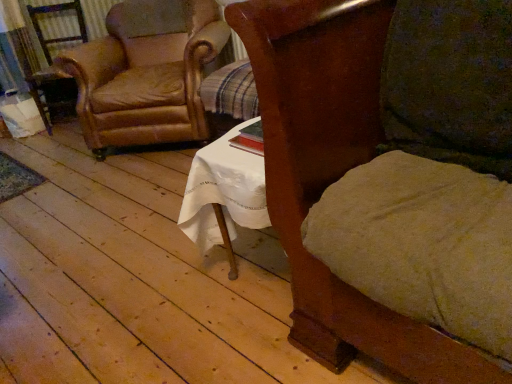
Image resolution: width=512 pixels, height=384 pixels. What do you see at coordinates (58, 12) in the screenshot? I see `leather armchair at left` at bounding box center [58, 12].

Describe the element at coordinates (146, 73) in the screenshot. I see `leather at left, the second chair when ordered from front to back` at that location.

Locate an element on the screen. The image size is (512, 384). leather armchair at left is located at coordinates coord(58,12).

Between point (191, 57) and point (296, 109), which one is positioned behind?

The point (191, 57) is behind.

Is leather at left, which appears as the first chair when viewed from the left, with wooden chair at center, the 2th chair from the left?

leather at left, which appears as the first chair when viewed from the left, is not next to wooden chair at center, the 2th chair from the left, and they're not touching.

Could you tell me if leather at left, the second chair when ordered from front to back, is turned towards wooden chair at center, the 2th chair from the left?

No.

How far apart are leather at left, arranged as the first chair when viewed from the back, and wooden chair at center, which is the first chair in right-to-left order?

leather at left, arranged as the first chair when viewed from the back, is 1.68 meters away from wooden chair at center, which is the first chair in right-to-left order.

Is point (330, 179) positioned behind point (93, 94)?

No, (330, 179) is in front of (93, 94).

From the image's perspective, is wooden chair at center, the 2th chair from the left, above leather at left, arranged as the first chair when viewed from the back?

No, from the image's perspective, wooden chair at center, the 2th chair from the left, is not on top of leather at left, arranged as the first chair when viewed from the back.

Which of these two, wooden chair at center, which is the first chair in right-to-left order, or leather at left, which appears as the first chair when viewed from the left, stands shorter?

With less height is leather at left, which appears as the first chair when viewed from the left.

From a real-world perspective, does wooden chair at center, which is the first chair in right-to-left order, stand above leather at left, the second chair when ordered from front to back?

Indeed, from a real-world perspective, wooden chair at center, which is the first chair in right-to-left order, stands above leather at left, the second chair when ordered from front to back.

From a real-world perspective, which chair is the 2nd one above the leather armchair at left? Please provide its 2D coordinates.

[(334, 176)]

Considering the relative sizes of wooden chair at center, the 2th chair from the left, and leather armchair at left in the image provided, is wooden chair at center, the 2th chair from the left, smaller than leather armchair at left?

No.

How distant is wooden chair at center, arranged as the first chair when viewed from the front, from leather armchair at left?

wooden chair at center, arranged as the first chair when viewed from the front, is 9.36 feet from leather armchair at left.

Does leather armchair at left have a greater width compared to leather at left, arranged as the first chair when viewed from the back?

Incorrect, the width of leather armchair at left does not surpass that of leather at left, arranged as the first chair when viewed from the back.

In the image, is leather armchair at left positioned in front of or behind leather at left, which appears as the first chair when viewed from the left?

In the image, leather armchair at left appears behind leather at left, which appears as the first chair when viewed from the left.

From a real-world perspective, is leather armchair at left under leather at left, which appears as the first chair when viewed from the left?

Yes, from a real-world perspective, leather armchair at left is under leather at left, which appears as the first chair when viewed from the left.

Are leather armchair at left and leather at left, arranged as the first chair when viewed from the back, located far from each other?

They are positioned close to each other.

From a real-world perspective, which chair is the 1st one above the leather armchair at left? Please provide its 2D coordinates.

[(146, 73)]

Which is more to the right, leather at left, arranged as the first chair when viewed from the back, or leather armchair at left?

Positioned to the right is leather at left, arranged as the first chair when viewed from the back.

Is leather at left, the second chair when ordered from front to back, with leather armchair at left?

There is a gap between leather at left, the second chair when ordered from front to back, and leather armchair at left.

In the scene shown: In terms of size, does leather armchair at left appear bigger or smaller than wooden chair at center, which is the first chair in right-to-left order?

leather armchair at left is smaller than wooden chair at center, which is the first chair in right-to-left order.

Is the depth of leather armchair at left greater than that of wooden chair at center, which is the first chair in right-to-left order?

Yes, leather armchair at left is behind wooden chair at center, which is the first chair in right-to-left order.

Is leather armchair at left to the left of wooden chair at center, which is the first chair in right-to-left order, from the viewer's perspective?

Correct, you'll find leather armchair at left to the left of wooden chair at center, which is the first chair in right-to-left order.

Looking at their sizes, would you say leather armchair at left is wider or thinner than wooden chair at center, arranged as the first chair when viewed from the front?

In the image, leather armchair at left appears to be more narrow than wooden chair at center, arranged as the first chair when viewed from the front.

The height and width of the screenshot is (384, 512). Find the location of `chair below the wooden chair at center, which is the first chair in right-to-left order (from a real-world perspective)`. chair below the wooden chair at center, which is the first chair in right-to-left order (from a real-world perspective) is located at coordinates (146, 73).

The width and height of the screenshot is (512, 384). I want to click on chair that appears behind the wooden chair at center, arranged as the first chair when viewed from the front, so click(x=146, y=73).

From the image, which object appears to be farther from wooden chair at center, which appears as the second chair when viewed from the back, leather armchair at left or leather at left, which appears as the first chair when viewed from the left?

leather armchair at left is further to wooden chair at center, which appears as the second chair when viewed from the back.

In the scene shown: Estimate the real-world distances between objects in this image. Which object is closer to leather armchair at left, wooden chair at center, which is the first chair in right-to-left order, or leather at left, the second chair when ordered from front to back?

Among the two, leather at left, the second chair when ordered from front to back, is located nearer to leather armchair at left.

Which object lies nearer to the anchor point wooden chair at center, arranged as the first chair when viewed from the front, leather at left, arranged as the first chair when viewed from the back, or leather armchair at left?

Based on the image, leather at left, arranged as the first chair when viewed from the back, appears to be nearer to wooden chair at center, arranged as the first chair when viewed from the front.

Based on their spatial positions, is leather armchair at left or wooden chair at center, which is the first chair in right-to-left order, closer to leather at left, the second chair when ordered from front to back?

Based on the image, leather armchair at left appears to be nearer to leather at left, the second chair when ordered from front to back.

Looking at the image, which one is located closer to leather at left, acting as the second chair starting from the right, wooden chair at center, the 2th chair from the left, or leather armchair at left?

Among the two, leather armchair at left is located nearer to leather at left, acting as the second chair starting from the right.

From the image, which object appears to be nearer to leather armchair at left, leather at left, which appears as the first chair when viewed from the left, or wooden chair at center, which is the first chair in right-to-left order?

leather at left, which appears as the first chair when viewed from the left, lies closer to leather armchair at left than the other object.

Where is `chair between wooden chair at center, which is the first chair in right-to-left order, and leather armchair at left, along the z-axis`? The image size is (512, 384). chair between wooden chair at center, which is the first chair in right-to-left order, and leather armchair at left, along the z-axis is located at coordinates (146, 73).